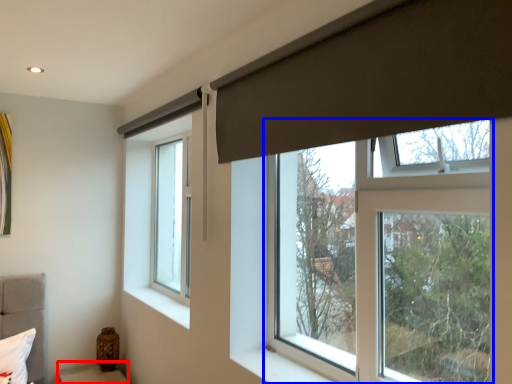
Question: Which object is further to the camera taking this photo, furniture (highlighted by a red box) or window (highlighted by a blue box)?

Choices:
 (A) furniture
 (B) window

Answer: (A)